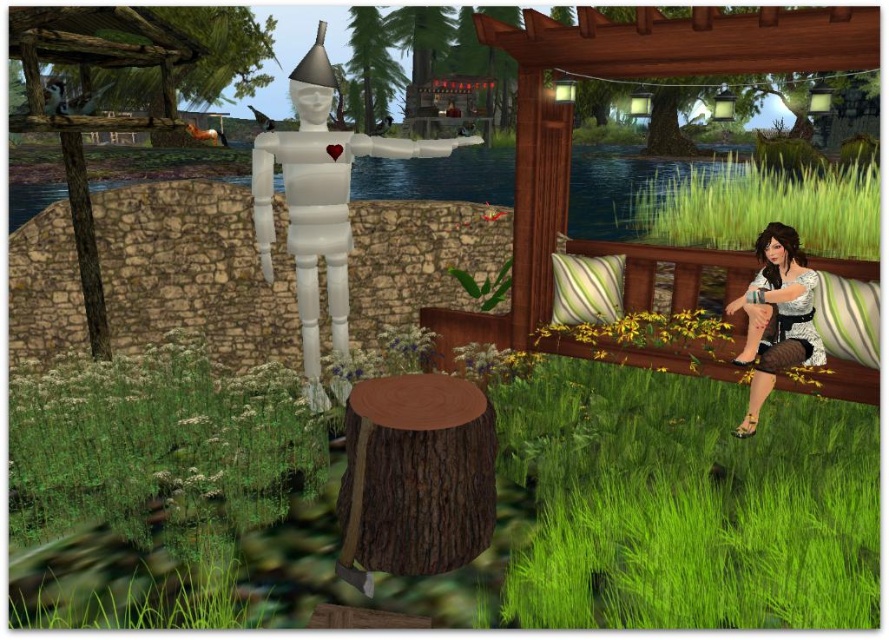
Question: Can you confirm if green grass at lower right is bigger than brown wood stump at center?

Choices:
 (A) no
 (B) yes

Answer: (B)

Question: Does green grass at lower right have a lesser width compared to transparent plastic figure at center?

Choices:
 (A) yes
 (B) no

Answer: (B)

Question: Which point appears closest to the camera in this image?

Choices:
 (A) (786, 339)
 (B) (709, 246)
 (C) (426, 400)

Answer: (C)

Question: Which object appears closest to the camera in this image?

Choices:
 (A) green striped cushion at upper right
 (B) green grass at lower right
 (C) white lace dress at right
 (D) green grass at upper center

Answer: (B)

Question: Which of the following is the closest to the observer?

Choices:
 (A) green grass at upper center
 (B) white lace dress at right

Answer: (B)

Question: Is green grass at lower right positioned behind brown wood stump at center?

Choices:
 (A) no
 (B) yes

Answer: (A)